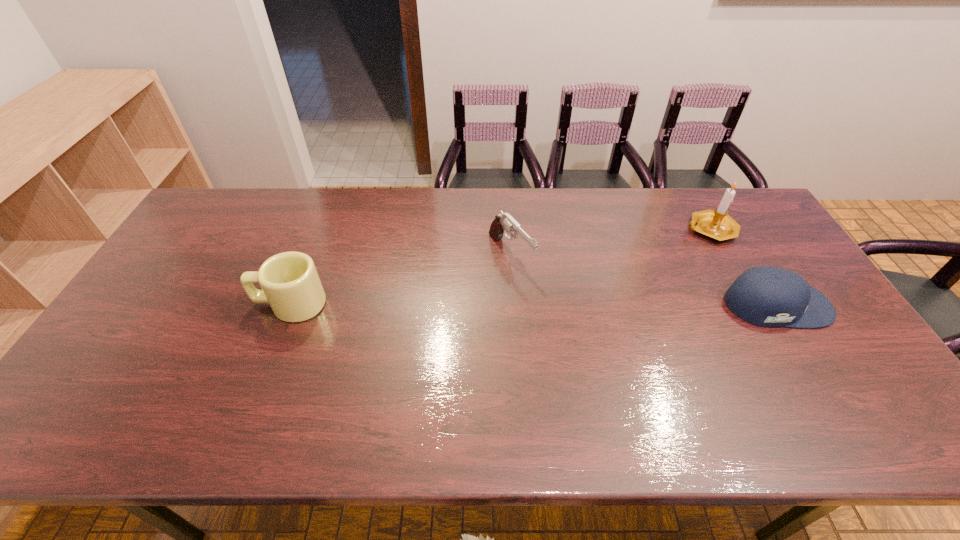
The image size is (960, 540). Identify the location of the leftmost object. (290, 283).

The width and height of the screenshot is (960, 540). Identify the location of the shortest object. click(767, 296).

Locate an element on the screen. The image size is (960, 540). the third object from right to left is located at coordinates (504, 222).

The height and width of the screenshot is (540, 960). In order to click on candle holder in this screenshot , I will do `click(716, 224)`.

Identify the location of vacant space located with the handle on the side of the leftmost object. (183, 304).

Find the location of a particular element. free space located 0.330m with the handle on the side of the leftmost object is located at coordinates (136, 304).

Find the location of a particular element. The image size is (960, 540). free point located with the handle on the side of the leftmost object is located at coordinates (161, 304).

You are a GUI agent. You are given a task and a screenshot of the screen. Output one action in this format:
    pyautogui.click(x=<x>, y=<y>)
    Task: Click on the free space located 0.230m at the muzzle of the third object from right to left
    This screenshot has width=960, height=540.
    Given the screenshot: What is the action you would take?
    pyautogui.click(x=574, y=327)

Find the location of a particular element. This screenshot has height=540, width=960. vacant space located 0.270m at the muzzle of the third object from right to left is located at coordinates (584, 338).

The height and width of the screenshot is (540, 960). Find the location of `vacant area located 0.090m at the muzzle of the third object from right to left`. vacant area located 0.090m at the muzzle of the third object from right to left is located at coordinates (541, 294).